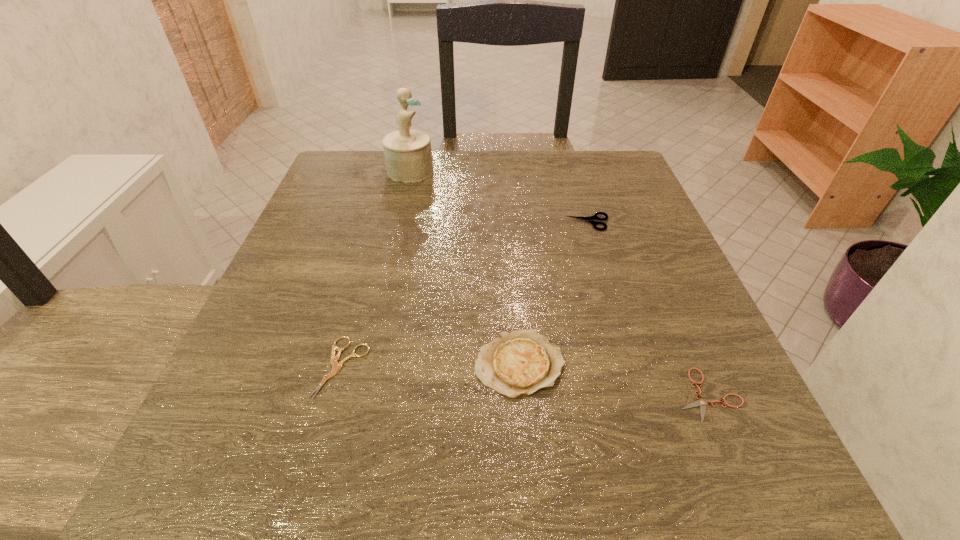
Identify the location of free region located 0.350m at the beak of the farthest object. (573, 171).

Image resolution: width=960 pixels, height=540 pixels. Find the location of `vacant space located on the left of the fourth shortest object`. vacant space located on the left of the fourth shortest object is located at coordinates (416, 364).

You are a GUI agent. You are given a task and a screenshot of the screen. Output one action in this format:
    pyautogui.click(x=<x>, y=<y>)
    Task: Click on the vacant area situated on the back of the second farthest object
    
    Given the screenshot: What is the action you would take?
    pyautogui.click(x=566, y=153)

In order to click on vacant area situated 0.390m on the right of the fourth tallest object in this screenshot , I will do `click(622, 367)`.

Locate an element on the screen. This screenshot has height=540, width=960. blank space located on the left of the shortest shears is located at coordinates (482, 395).

The image size is (960, 540). Identify the location of object that is positioned at the far edge. (408, 156).

Locate an element on the screen. The image size is (960, 540). figurine situated at the left edge is located at coordinates pyautogui.click(x=408, y=156).

The image size is (960, 540). I want to click on shears that is at the left edge, so tap(336, 366).

Find the location of `object located in the far left corner section of the desktop`. object located in the far left corner section of the desktop is located at coordinates (408, 156).

In the image, there is a desktop. Find the location of `vacant space at the far edge`. vacant space at the far edge is located at coordinates (450, 152).